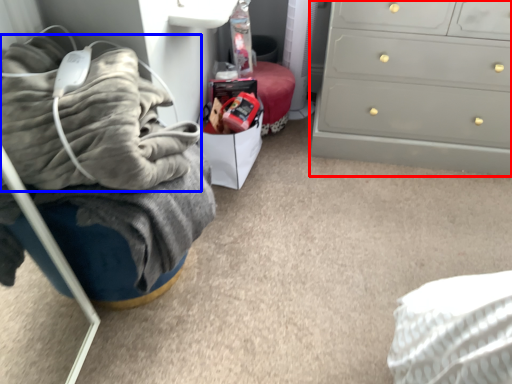
Question: Which of the following is the closest to the observer, chest of drawers (highlighted by a red box) or blanket (highlighted by a blue box)?

Choices:
 (A) chest of drawers
 (B) blanket

Answer: (B)